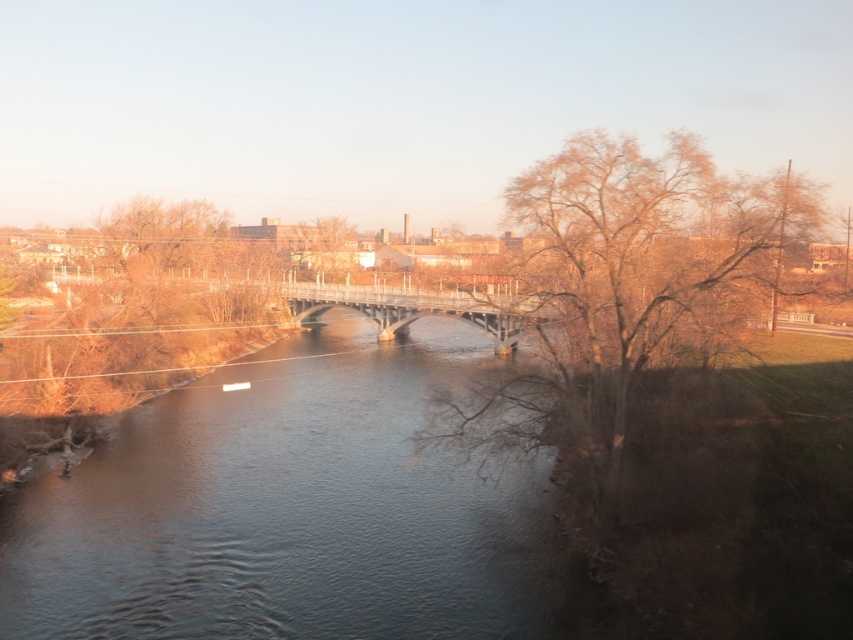
You are a GUI agent. You are given a task and a screenshot of the screen. Output one action in this format:
    pyautogui.click(x=<x>, y=<y>)
    Task: Click on the dark blue water at center
    Image resolution: width=853 pixels, height=640 pixels.
    Given the screenshot: What is the action you would take?
    pyautogui.click(x=291, y=509)

Can you confirm if dark blue water at center is smaller than brown leafless tree at center?

No, dark blue water at center is not smaller than brown leafless tree at center.

Between point (465, 589) and point (308, 253), which one is positioned in front?

Point (465, 589) is more forward.

This screenshot has height=640, width=853. I want to click on dark blue water at center, so click(x=291, y=509).

Which is above, concrete gray bridge at center or brown leafless tree at center?

brown leafless tree at center is higher up.

Which of these two, concrete gray bridge at center or brown leafless tree at center, stands taller?

brown leafless tree at center is taller.

Is point (344, 304) behind point (302, 246)?

No.

You are a GUI agent. You are given a task and a screenshot of the screen. Output one action in this format:
    pyautogui.click(x=<x>, y=<y>)
    Task: Click on the concrete gray bridge at center
    This screenshot has width=853, height=640.
    Given the screenshot: What is the action you would take?
    pyautogui.click(x=415, y=308)

Does brown leafless tree at right have a larger size compared to concrete gray bridge at center?

Incorrect, brown leafless tree at right is not larger than concrete gray bridge at center.

Is brown leafless tree at right wider than concrete gray bridge at center?

In fact, brown leafless tree at right might be narrower than concrete gray bridge at center.

Between point (515, 179) and point (479, 301), which one is positioned in front?

Point (479, 301) is in front.

Find the location of a particular element. The image size is (853, 640). brown leafless tree at right is located at coordinates (631, 284).